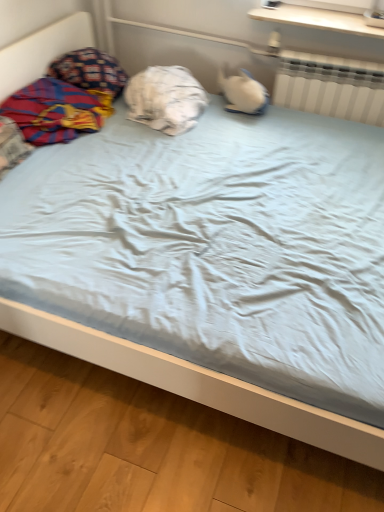
Question: Considering the relative positions of plaid fabric blanket at left and white plastic radiator at upper right in the image provided, is plaid fabric blanket at left to the right of white plastic radiator at upper right from the viewer's perspective?

Choices:
 (A) yes
 (B) no

Answer: (B)

Question: From a real-world perspective, is plaid fabric blanket at left positioned under white plastic radiator at upper right based on gravity?

Choices:
 (A) yes
 (B) no

Answer: (A)

Question: Is plaid fabric blanket at left further to camera compared to white plastic radiator at upper right?

Choices:
 (A) yes
 (B) no

Answer: (B)

Question: Can you confirm if plaid fabric blanket at left is thinner than white plastic radiator at upper right?

Choices:
 (A) no
 (B) yes

Answer: (A)

Question: Does plaid fabric blanket at left come in front of white plastic radiator at upper right?

Choices:
 (A) no
 (B) yes

Answer: (B)

Question: Considering the relative positions of plaid fabric blanket at left and white plastic radiator at upper right in the image provided, is plaid fabric blanket at left to the left of white plastic radiator at upper right from the viewer's perspective?

Choices:
 (A) no
 (B) yes

Answer: (B)

Question: Is white plastic radiator at upper right aimed at white cotton pillow at center, the 2th pillow from the left?

Choices:
 (A) no
 (B) yes

Answer: (A)

Question: Considering the relative sizes of white plastic radiator at upper right and white cotton pillow at center, the 2th pillow from the left, in the image provided, is white plastic radiator at upper right smaller than white cotton pillow at center, the 2th pillow from the left,?

Choices:
 (A) yes
 (B) no

Answer: (A)

Question: Is white plastic radiator at upper right far away from white cotton pillow at center, positioned as the 1th pillow in right-to-left order?

Choices:
 (A) yes
 (B) no

Answer: (B)

Question: Is white plastic radiator at upper right behind white cotton pillow at center, the 2th pillow from the left?

Choices:
 (A) no
 (B) yes

Answer: (B)

Question: From the image's perspective, is white plastic radiator at upper right on top of white cotton pillow at center, the 2th pillow from the left?

Choices:
 (A) no
 (B) yes

Answer: (B)

Question: Considering the relative sizes of white plastic radiator at upper right and white cotton pillow at center, the 2th pillow from the left, in the image provided, is white plastic radiator at upper right thinner than white cotton pillow at center, the 2th pillow from the left,?

Choices:
 (A) no
 (B) yes

Answer: (B)

Question: From the image's perspective, would you say white plastic radiator at upper right is shown under white wood shelf at upper center?

Choices:
 (A) yes
 (B) no

Answer: (A)